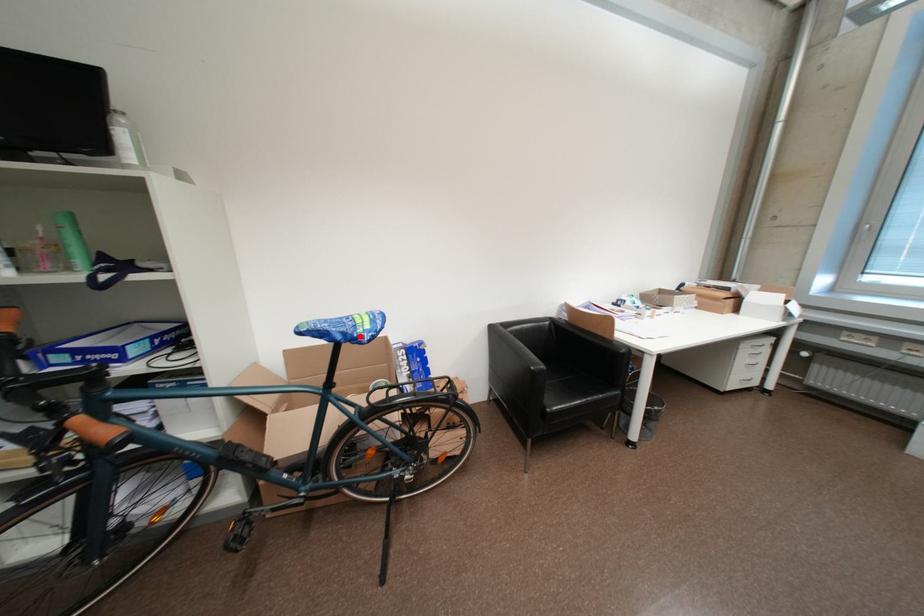
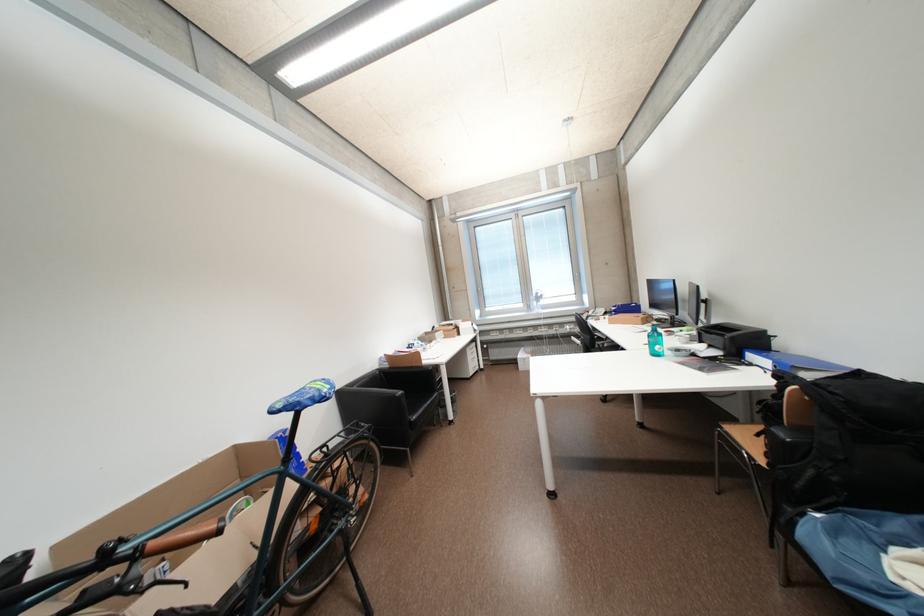
Question: A red point is marked in image1. In image2, is the corresponding 3D point closer to the camera or farther? Reply with the corresponding letter.

Choices:
 (A) The corresponding 3D point is closer.
 (B) The corresponding 3D point is farther.

Answer: (A)